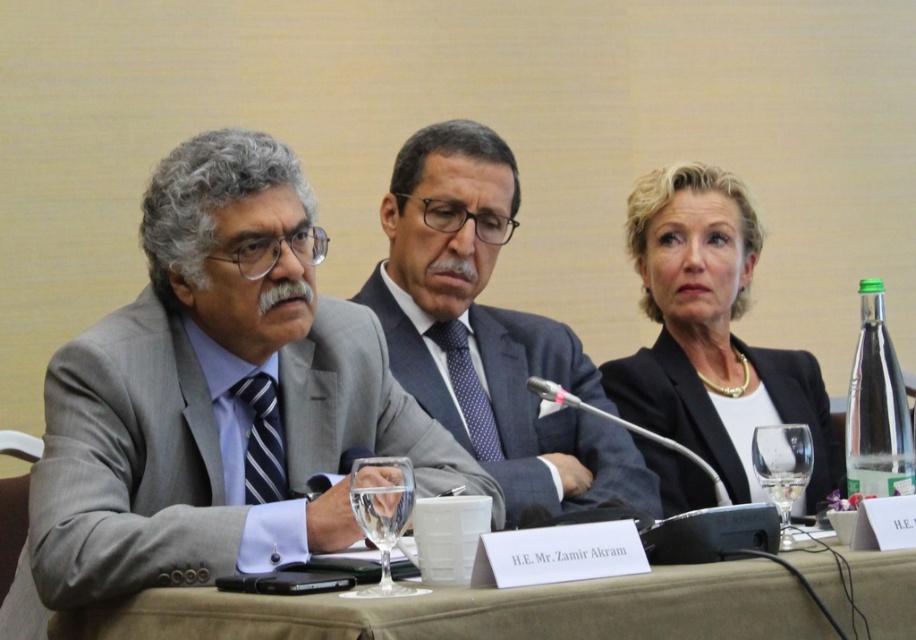
Question: From the image, what is the correct spatial relationship of matte black suit at center in relation to brown fabric table at center?

Choices:
 (A) right
 (B) left

Answer: (A)

Question: Which of the following is the closest to the observer?

Choices:
 (A) (498, 416)
 (B) (276, 445)
 (C) (358, 508)
 (D) (897, 417)

Answer: (C)

Question: Does brown fabric table at center have a smaller size compared to green glass bottle at right?

Choices:
 (A) no
 (B) yes

Answer: (A)

Question: Which of the following is the farthest from the observer?

Choices:
 (A) (679, 604)
 (B) (262, 161)
 (C) (485, 129)

Answer: (C)

Question: Is the position of gray suit at center more distant than that of brown fabric table at center?

Choices:
 (A) yes
 (B) no

Answer: (A)

Question: Estimate the real-world distances between objects in this image. Which object is closer to the brown fabric table at center?

Choices:
 (A) clear glass wine glass at right
 (B) black leather jacket at upper center
 (C) gray suit at center
 (D) clear glass wine glass at center

Answer: (D)